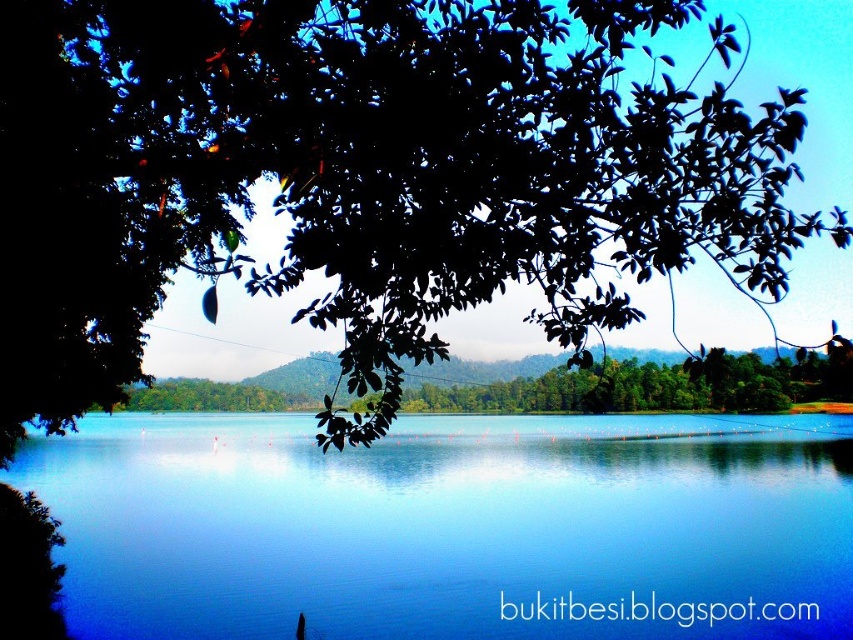
Which is more to the right, green leafy tree at upper left or transparent blue water at center?

transparent blue water at center is more to the right.

Between green leafy tree at upper left and transparent blue water at center, which one appears on the left side from the viewer's perspective?

From the viewer's perspective, green leafy tree at upper left appears more on the left side.

I want to click on green leafy tree at upper left, so click(x=360, y=177).

Does transparent blue water at center have a greater height compared to green leafy tree at center?

Indeed, transparent blue water at center has a greater height compared to green leafy tree at center.

Can you confirm if transparent blue water at center is positioned below green leafy tree at center?

Yes.

Which is in front, point (379, 468) or point (465, 408)?

Point (379, 468)

This screenshot has height=640, width=853. Find the location of `transparent blue water at center`. transparent blue water at center is located at coordinates (451, 528).

Which is above, green leafy tree at upper left or green leafy tree at center?

Positioned higher is green leafy tree at upper left.

Which is more to the left, green leafy tree at upper left or green leafy tree at center?

green leafy tree at upper left

Which is behind, point (689, 232) or point (772, 406)?

The point (772, 406) is more distant.

At what (x,y) coordinates should I click in order to perform the action: click on green leafy tree at upper left. Please return your answer as a coordinate pair (x, y). Looking at the image, I should click on (360, 177).